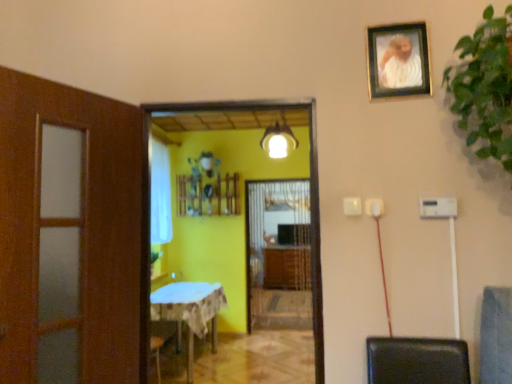
Question: Considering their positions, is yellow matte screen door at center, which appears as the 2th screen door when viewed from the back, located in front of or behind white glossy light fixture at center?

Choices:
 (A) front
 (B) behind

Answer: (A)

Question: Considering the positions of point (190, 104) and point (279, 137), is point (190, 104) closer or farther from the camera than point (279, 137)?

Choices:
 (A) farther
 (B) closer

Answer: (B)

Question: Considering the real-world distances, which object is farthest from the gold-framed photo at upper right?

Choices:
 (A) yellow matte screen door at center, positioned as the first screen door in front-to-back order
 (B) wooden cabinet at center
 (C) green leafy plant at upper right
 (D) white sheer curtain at left
 (E) white glossy light fixture at center

Answer: (B)

Question: Based on their relative distances, which object is nearer to the wooden cabinet at center?

Choices:
 (A) white sheer curtain at left
 (B) green leafy plant at upper right
 (C) yellow matte screen door at center, positioned as the first screen door in front-to-back order
 (D) gold-framed photo at upper right
 (E) blue cloth-covered table at center

Answer: (A)